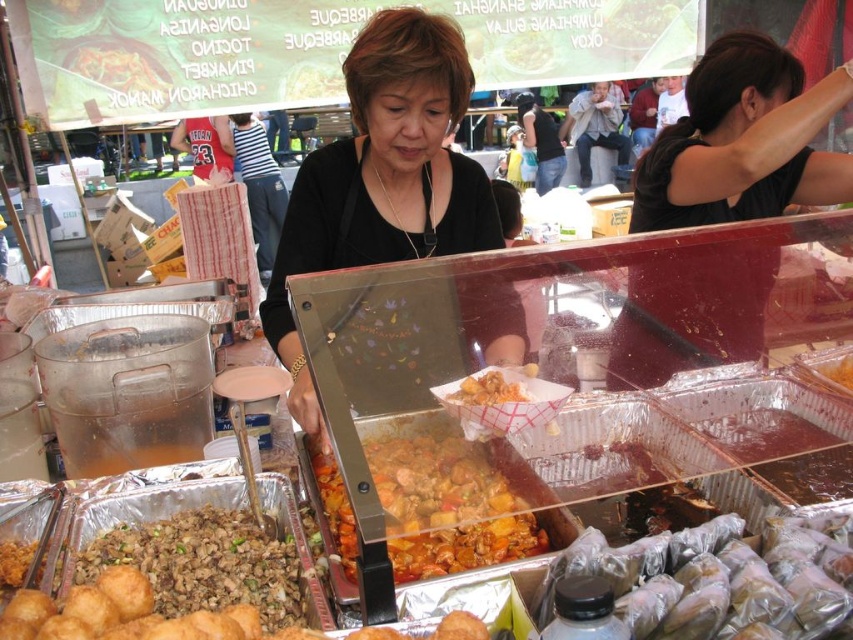
You are a customer at the food stall and want to choose between the brown crumbly meat at lower left and the green leafy vegetables at center. Which option is closer to the vendor who is serving the stew?

The brown crumbly meat at lower left is closer to the vendor who is serving the stew because it is positioned below the green leafy vegetables at center, which places it nearer to the vendor.

You are a customer at the food stall and want to reach both the point at (459, 168) and the point at (834, 381). Which point should you approach first to get closer to both?

You should approach point (459, 168) first because it is closer to you than point (834, 381), which is further away.